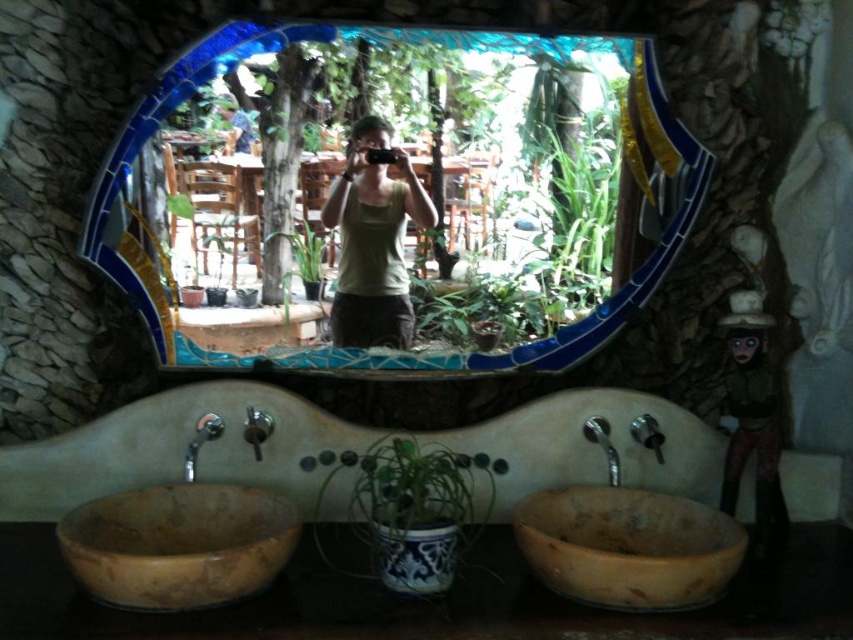
Between silver metallic faucet at lower left and silver metallic faucet at right, which one is positioned higher?

Positioned higher is silver metallic faucet at lower left.

Between point (183, 464) and point (613, 449), which one is positioned in front?

Point (613, 449)

The height and width of the screenshot is (640, 853). Find the location of `silver metallic faucet at lower left`. silver metallic faucet at lower left is located at coordinates (200, 442).

How much distance is there between natural wood sink at lower right and silver metallic faucet at lower left?

31.81 inches

Is point (730, 564) less distant than point (192, 451)?

That is True.

What do you see at coordinates (627, 541) in the screenshot? The height and width of the screenshot is (640, 853). I see `natural wood sink at lower right` at bounding box center [627, 541].

The height and width of the screenshot is (640, 853). What are the coordinates of `natural wood sink at lower right` in the screenshot? It's located at (627, 541).

Does natural wood sink at lower left appear on the left side of silver metallic faucet at lower left?

Incorrect, natural wood sink at lower left is not on the left side of silver metallic faucet at lower left.

Does point (219, 602) lie behind point (206, 435)?

That is False.

At what (x,y) coordinates should I click in order to perform the action: click on natural wood sink at lower left. Please return your answer as a coordinate pair (x, y). The width and height of the screenshot is (853, 640). Looking at the image, I should click on (178, 540).